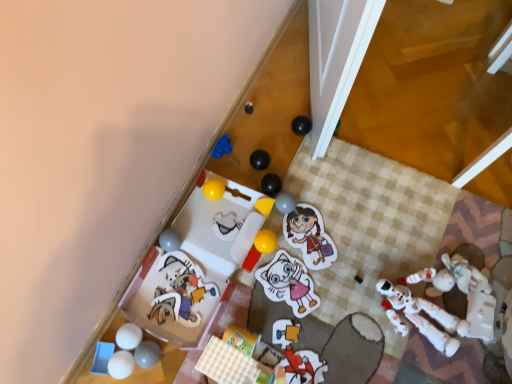
Locate an element on the screen. The height and width of the screenshot is (384, 512). vacant space behind yellow matte block at upper center, which is the fifth toy in right-to-left order is located at coordinates (266, 155).